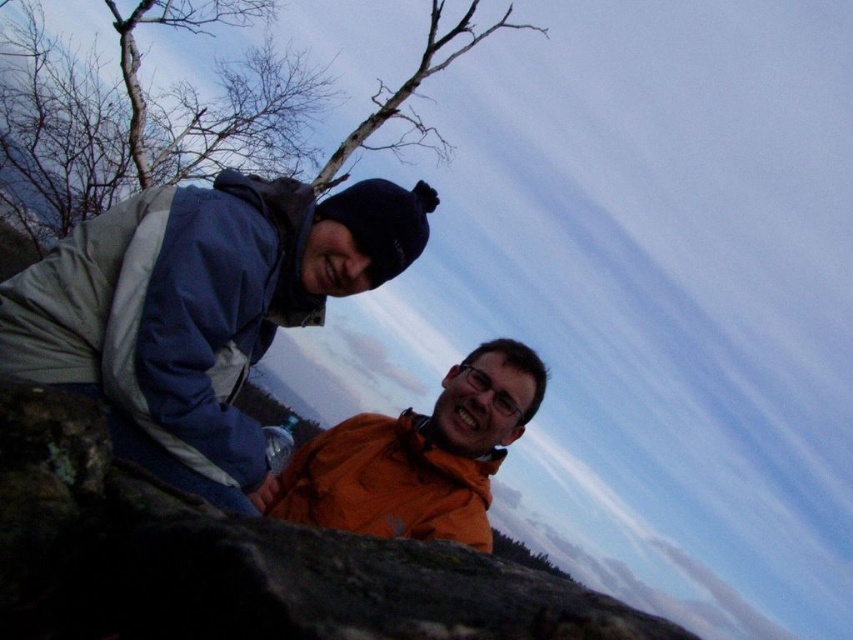
Question: Considering the real-world distances, which object is farthest from the blue/gray fleece jacket at left?

Choices:
 (A) bare branches at upper left
 (B) orange matte jacket at center

Answer: (A)

Question: Which point is farther to the camera?

Choices:
 (A) orange matte jacket at center
 (B) blue/gray fleece jacket at left
 (C) bare branches at upper left

Answer: (C)

Question: Which object appears closest to the camera in this image?

Choices:
 (A) orange matte jacket at center
 (B) blue/gray fleece jacket at left
 (C) rough textured rock at lower center
 (D) bare branches at upper left

Answer: (C)

Question: In this image, where is rough textured rock at lower center located relative to bare branches at upper left?

Choices:
 (A) above
 (B) below

Answer: (B)

Question: Where is blue/gray fleece jacket at left located in relation to bare branches at upper left in the image?

Choices:
 (A) above
 (B) below

Answer: (B)

Question: Does rough textured rock at lower center appear under blue/gray fleece jacket at left?

Choices:
 (A) yes
 (B) no

Answer: (A)